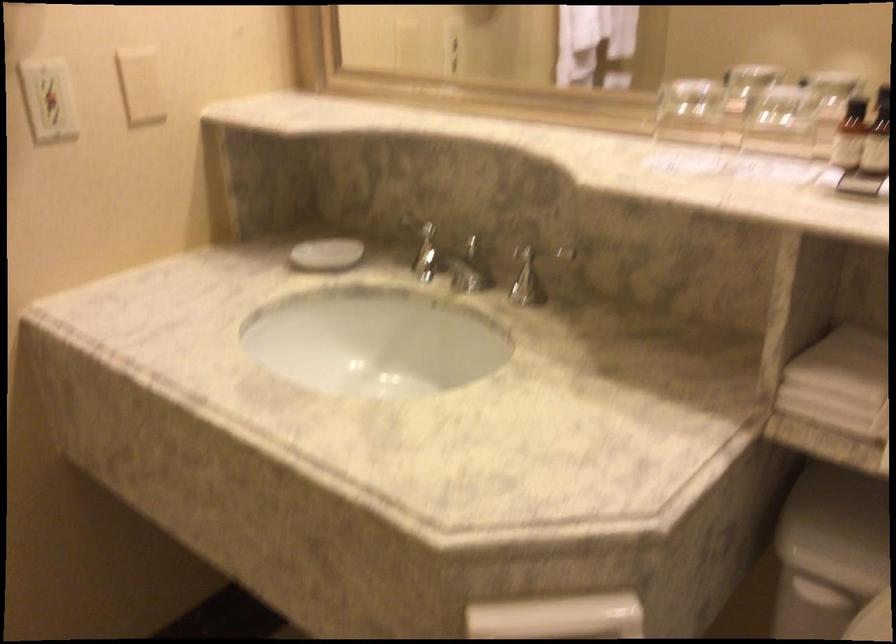
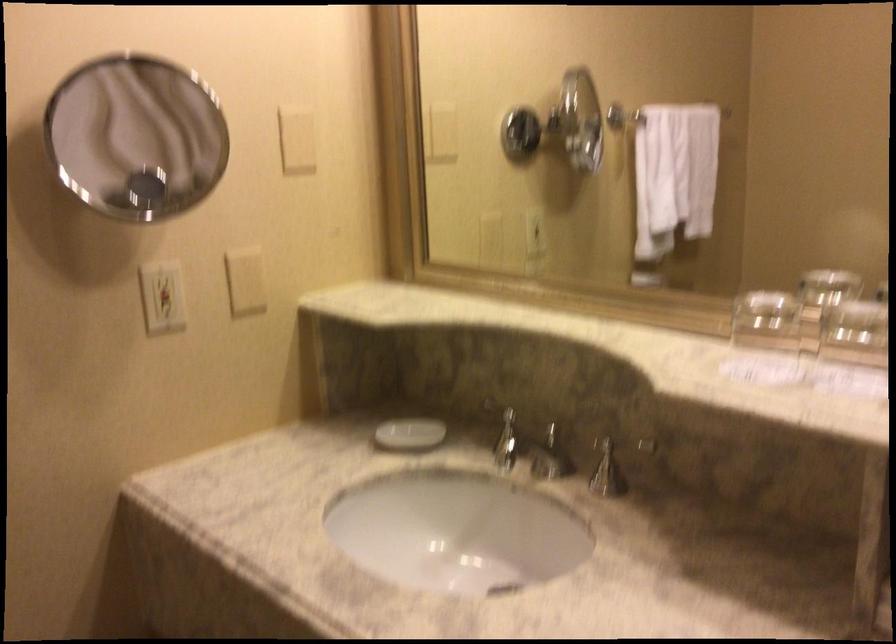
Question: The images are taken continuously from a first-person perspective. In which direction are you moving?

Choices:
 (A) Left
 (B) Right
 (C) Forward
 (D) Backward

Answer: (D)